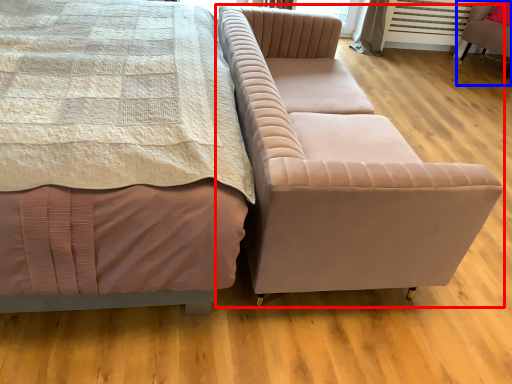
Question: Which point is further to the camera, studio couch (highlighted by a red box) or chair (highlighted by a blue box)?

Choices:
 (A) studio couch
 (B) chair

Answer: (B)